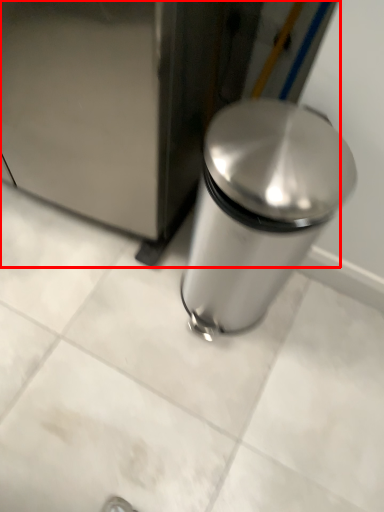
Question: From the image's perspective, what is the correct spatial positioning of appliance (annotated by the red box) in reference to waste container?

Choices:
 (A) above
 (B) below

Answer: (A)